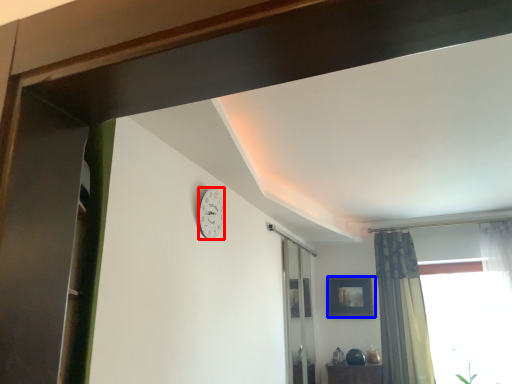
Question: Which object appears farthest to the camera in this image, clock (highlighted by a red box) or picture frame (highlighted by a blue box)?

Choices:
 (A) clock
 (B) picture frame

Answer: (B)